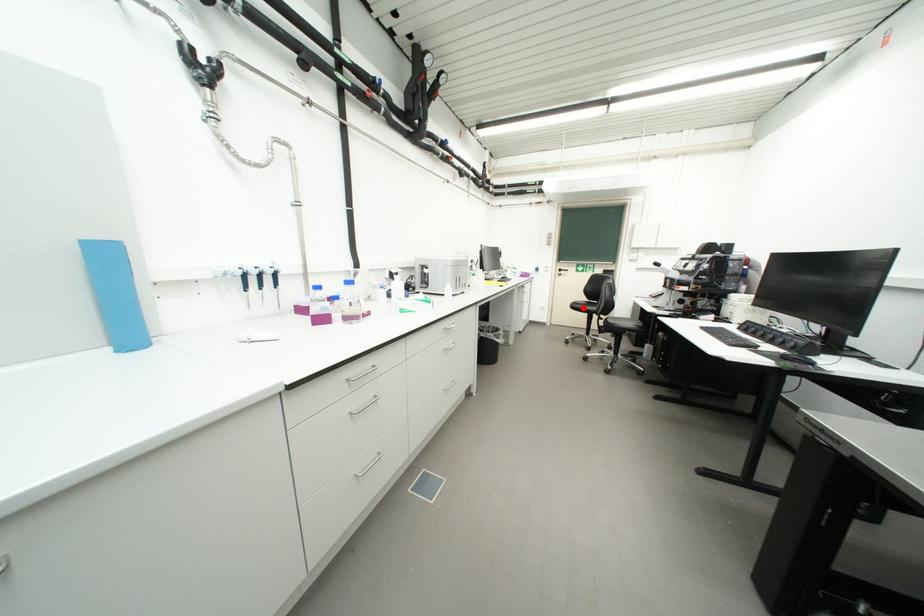
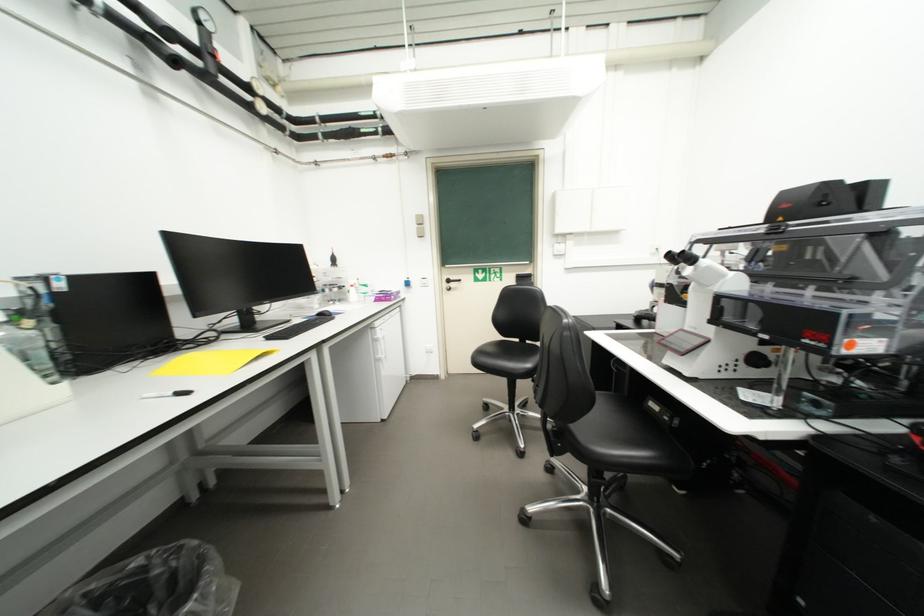
Question: A red point is marked in image1. In image2, is the corresponding 3D point closer to the camera or farther? Reply with the corresponding letter.

Choices:
 (A) The corresponding 3D point is closer.
 (B) The corresponding 3D point is farther.

Answer: (B)